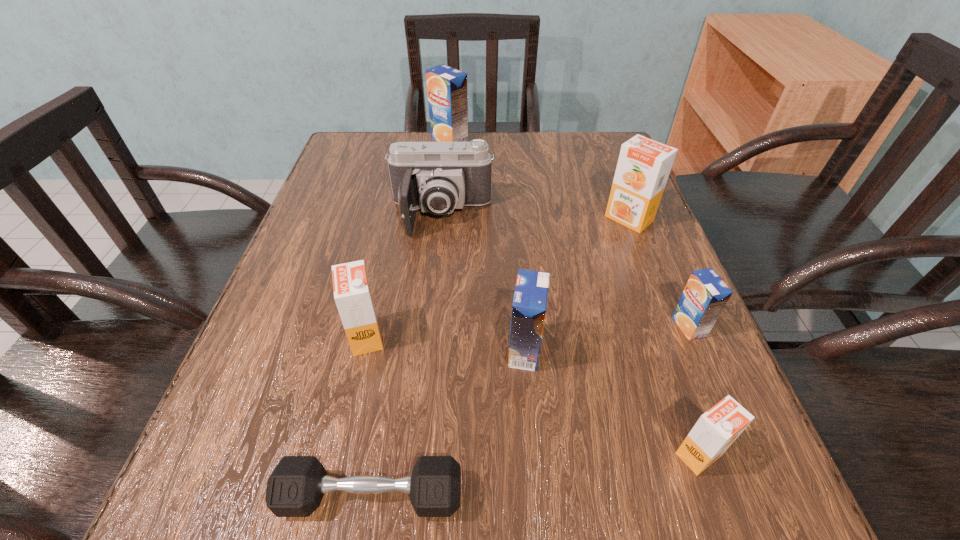
The height and width of the screenshot is (540, 960). I want to click on blank space located on the right of the dumbbell, so click(525, 496).

Where is `object located at the far edge`? object located at the far edge is located at coordinates (447, 87).

Find the location of `orange juice that is at the near edge`. orange juice that is at the near edge is located at coordinates (715, 431).

Locate an element on the screen. The height and width of the screenshot is (540, 960). dumbbell situated at the near edge is located at coordinates (295, 488).

Locate an element on the screen. Image resolution: width=960 pixels, height=540 pixels. orange juice that is at the left edge is located at coordinates (352, 292).

Find the location of a particular element. dumbbell at the left edge is located at coordinates (295, 488).

Identify the location of object at the near left corner. (295, 488).

At what (x,y) coordinates should I click in order to perform the action: click on object at the near right corner. Please return your answer as a coordinate pair (x, y). Looking at the image, I should click on (715, 431).

You are a GUI agent. You are given a task and a screenshot of the screen. Output one action in this format:
    pyautogui.click(x=<x>, y=<y>)
    Task: Click on the vacant space at the left edge of the desktop
    
    Given the screenshot: What is the action you would take?
    click(x=359, y=237)

Where is `vacant space at the right edge`? This screenshot has width=960, height=540. vacant space at the right edge is located at coordinates (660, 331).